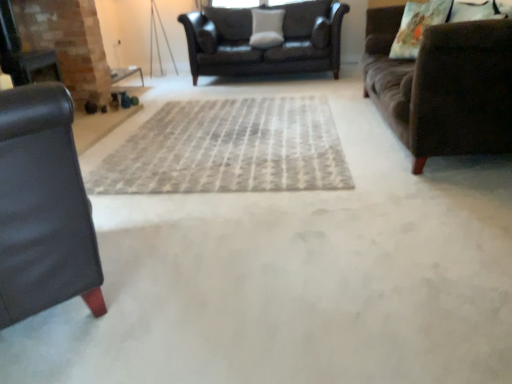
Question: Are dark brown leather couch at center, which is counted as the third studio couch, starting from the front, and black leather fireplace at left beside each other?

Choices:
 (A) no
 (B) yes

Answer: (A)

Question: Is dark brown leather couch at center, the 1th studio couch from the back, positioned in front of black leather fireplace at left?

Choices:
 (A) yes
 (B) no

Answer: (B)

Question: Is dark brown leather couch at center, the 1th studio couch from the back, not within black leather fireplace at left?

Choices:
 (A) yes
 (B) no

Answer: (A)

Question: Does dark brown leather couch at center, which is counted as the third studio couch, starting from the front, have a lesser height compared to black leather fireplace at left?

Choices:
 (A) no
 (B) yes

Answer: (B)

Question: From the image's perspective, does dark brown leather couch at center, the 1th studio couch from the back, appear lower than black leather fireplace at left?

Choices:
 (A) yes
 (B) no

Answer: (B)

Question: From a real-world perspective, is dark brown leather couch at center, which is counted as the third studio couch, starting from the front, physically above black leather fireplace at left?

Choices:
 (A) no
 (B) yes

Answer: (A)

Question: From a real-world perspective, is brown fabric couch at right, which is the 2th studio couch in front-to-back order, under white fabric pillow at center, marked as the 1th pillow in a left-to-right arrangement?

Choices:
 (A) no
 (B) yes

Answer: (B)

Question: Is brown fabric couch at right, the 2th studio couch in the back-to-front sequence, further to the viewer compared to white fabric pillow at center, the second pillow from the right?

Choices:
 (A) yes
 (B) no

Answer: (B)

Question: Could you tell me if brown fabric couch at right, the 2th studio couch in the back-to-front sequence, is facing white fabric pillow at center, which ranks as the 1th pillow in top-to-bottom order?

Choices:
 (A) no
 (B) yes

Answer: (A)

Question: From the image's perspective, is brown fabric couch at right, which is the 2th studio couch in front-to-back order, under white fabric pillow at center, positioned as the second pillow in bottom-to-top order?

Choices:
 (A) no
 (B) yes

Answer: (B)

Question: Is the surface of brown fabric couch at right, which is the 2th studio couch in front-to-back order, in direct contact with white fabric pillow at center, the second pillow from the right?

Choices:
 (A) yes
 (B) no

Answer: (B)

Question: From the image's perspective, is brown fabric couch at right, which is the 2th studio couch in front-to-back order, on white fabric pillow at center, the second pillow from the right?

Choices:
 (A) yes
 (B) no

Answer: (B)

Question: From the image's perspective, is white fabric pillow at center, positioned as the second pillow in bottom-to-top order, under brown fabric couch at right, the 2th studio couch in the back-to-front sequence?

Choices:
 (A) no
 (B) yes

Answer: (A)